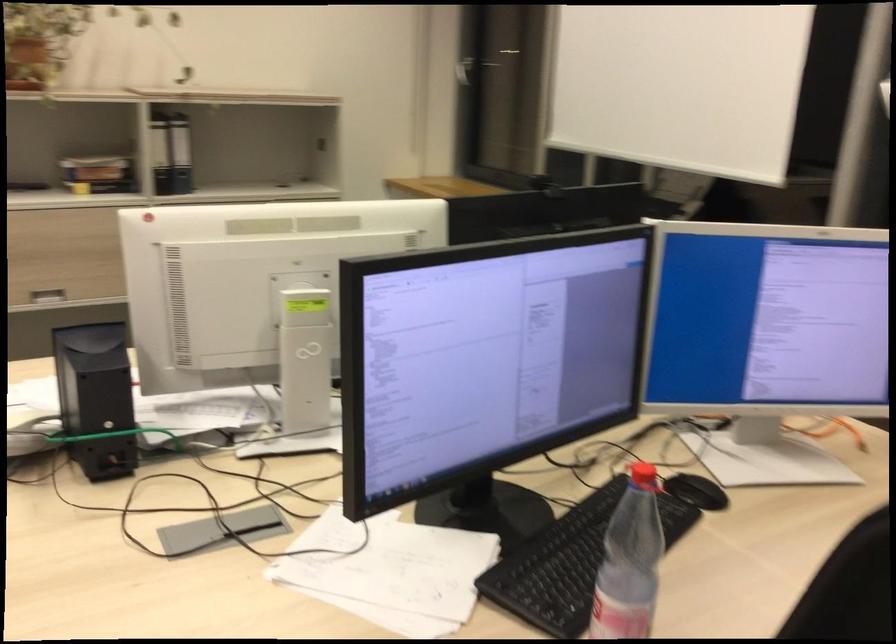
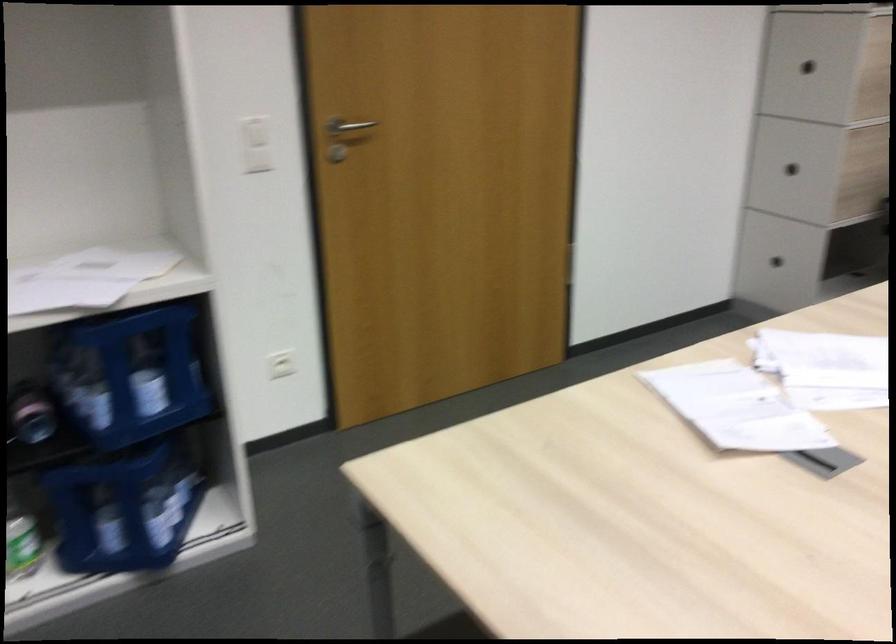
Based on the photo, based on the continuous images, in which direction is the camera rotating?

The camera's rotation is toward left-down.